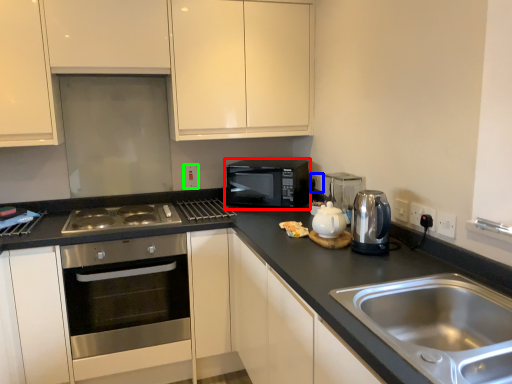
Question: Which is farther away from microwave oven (highlighted by a red box)? electric outlet (highlighted by a blue box) or electric outlet (highlighted by a green box)?

Choices:
 (A) electric outlet
 (B) electric outlet

Answer: (B)